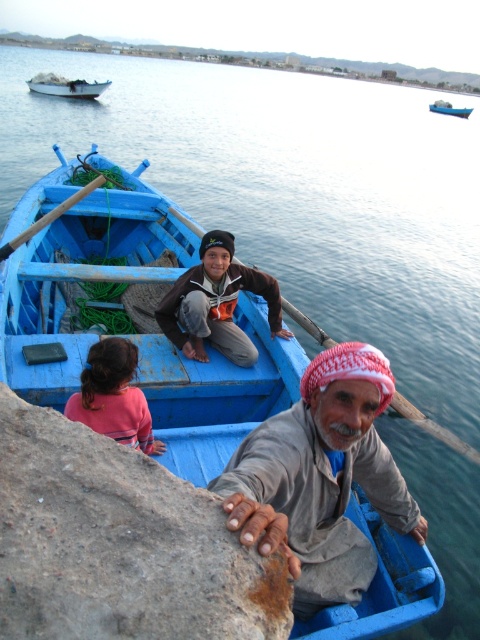
Question: Which object is positioned closest to the white plastic boat at upper left?

Choices:
 (A) rusty stone at lower left
 (B) brown cotton shirt at center
 (C) blue wooden boat at upper center

Answer: (B)

Question: Does matte blue boat at center lie behind blue wooden boat at upper center?

Choices:
 (A) no
 (B) yes

Answer: (A)

Question: Does white plastic boat at upper left appear on the right side of blue wooden boat at upper center?

Choices:
 (A) no
 (B) yes

Answer: (A)

Question: Among these points, which one is nearest to the camera?

Choices:
 (A) (95, 369)
 (B) (142, 308)

Answer: (A)

Question: Which object is positioned closest to the blue wooden boat at upper center?

Choices:
 (A) brown cotton shirt at center
 (B) gray fabric headscarf at lower center

Answer: (A)

Question: Is matte blue boat at center thinner than blue wooden boat at upper center?

Choices:
 (A) yes
 (B) no

Answer: (A)